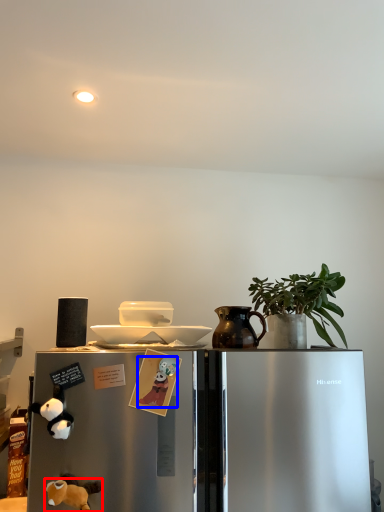
Question: Which object appears farthest to the camera in this image, animal (highlighted by a red box) or animal (highlighted by a blue box)?

Choices:
 (A) animal
 (B) animal

Answer: (B)